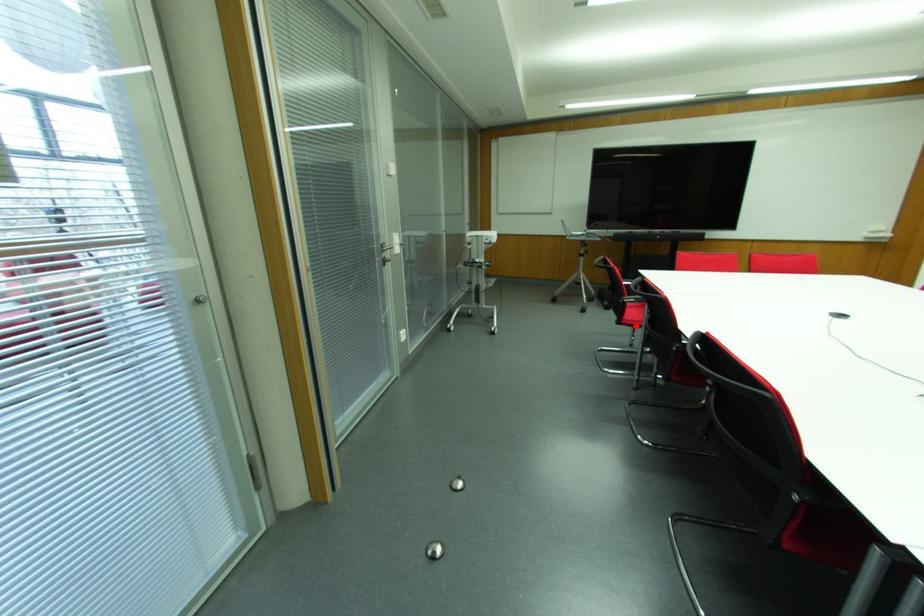
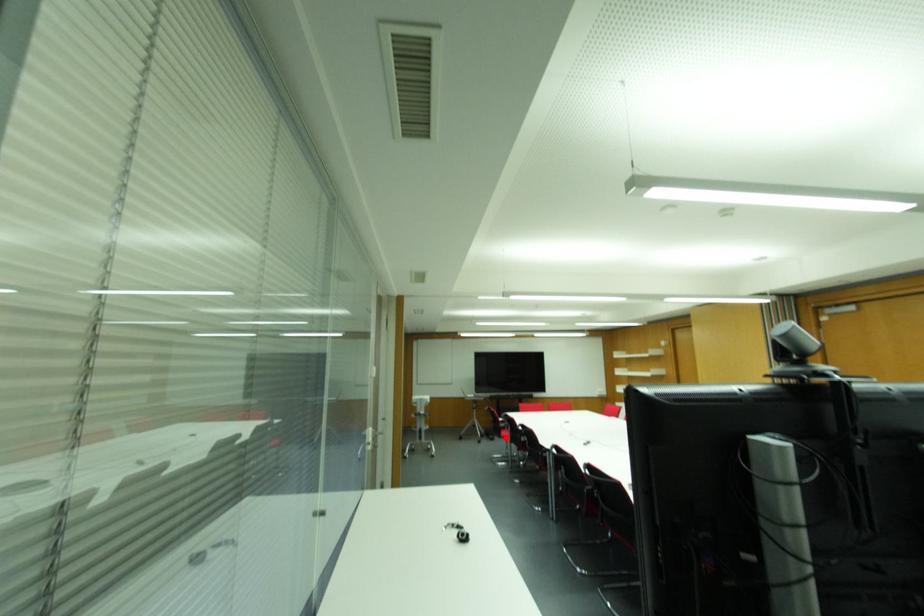
I am providing you with two images of the same scene from different viewpoints. A red point is marked on the first image and another point is marked on the second image. Does the point marked in image1 correspond to the same location as the one in image2?

Yes